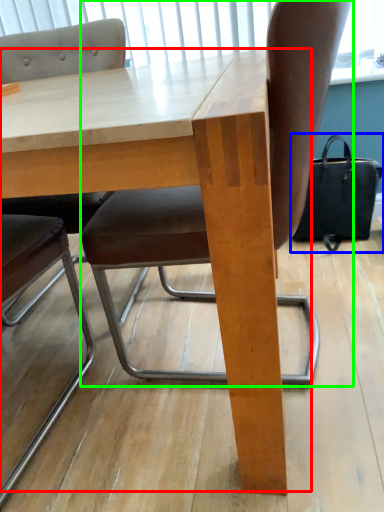
Question: Which object is positioned farthest from table (highlighted by a red box)? Select from handbag (highlighted by a blue box) and chair (highlighted by a green box).

Choices:
 (A) handbag
 (B) chair

Answer: (A)